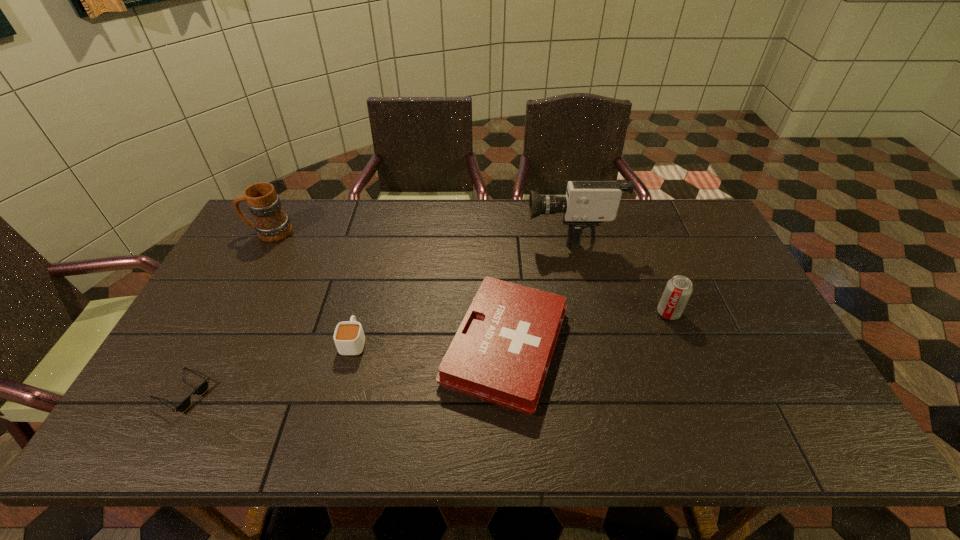
Locate an element on the screen. The width and height of the screenshot is (960, 540). empty space that is in between the camcorder and the sunglasses is located at coordinates (375, 312).

Locate an element on the screen. The width and height of the screenshot is (960, 540). empty location between the shortest object and the first-aid kit is located at coordinates (344, 369).

Locate an element on the screen. Image resolution: width=960 pixels, height=540 pixels. vacant area that lies between the camcorder and the shortest object is located at coordinates (375, 312).

I want to click on empty space between the first-aid kit and the sunglasses, so click(x=344, y=369).

The image size is (960, 540). I want to click on unoccupied position between the mug and the third object from left to right, so click(311, 287).

Locate an element on the screen. Image resolution: width=960 pixels, height=540 pixels. free point between the camcorder and the cup is located at coordinates (462, 286).

Find the location of a particular element. The image size is (960, 540). free space between the rightmost object and the mug is located at coordinates (468, 273).

What are the coordinates of `vacant area between the first-aid kit and the soda can` in the screenshot? It's located at (587, 330).

The width and height of the screenshot is (960, 540). I want to click on unoccupied area between the first-aid kit and the shortest object, so click(344, 369).

Where is `free spot between the fourth object from right to left and the sunglasses`? free spot between the fourth object from right to left and the sunglasses is located at coordinates (268, 367).